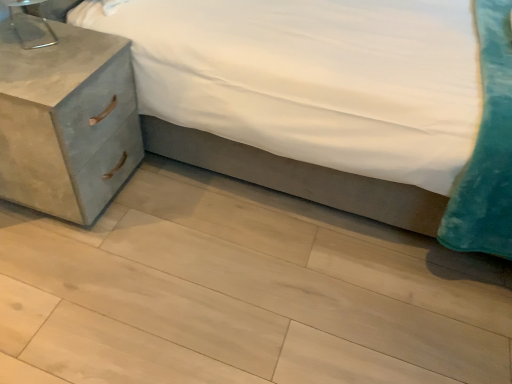
Find the location of a particular element. unoccupied region to the right of metallic silver table lamp at upper left is located at coordinates (x=84, y=52).